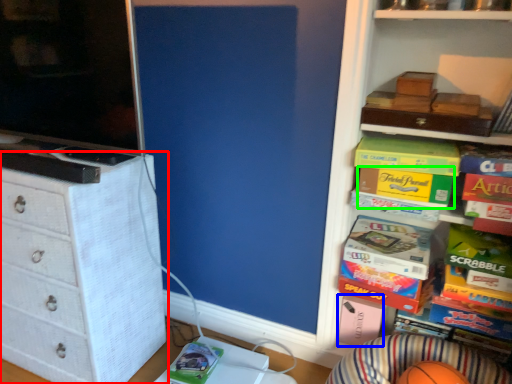
Question: Which object is positioned farthest from chest of drawers (highlighted by a red box)? Select from box (highlighted by a blue box) and storage box (highlighted by a green box).

Choices:
 (A) box
 (B) storage box

Answer: (B)